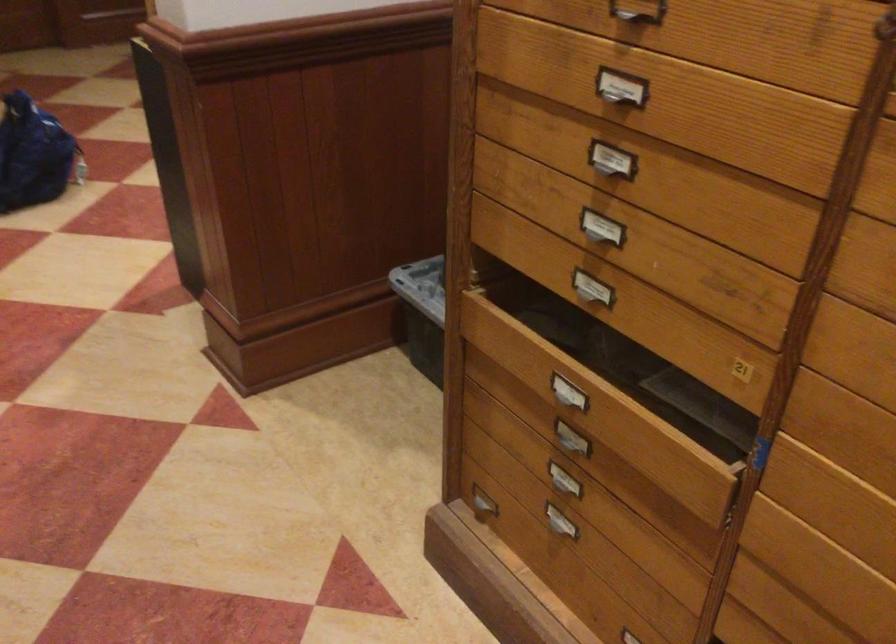
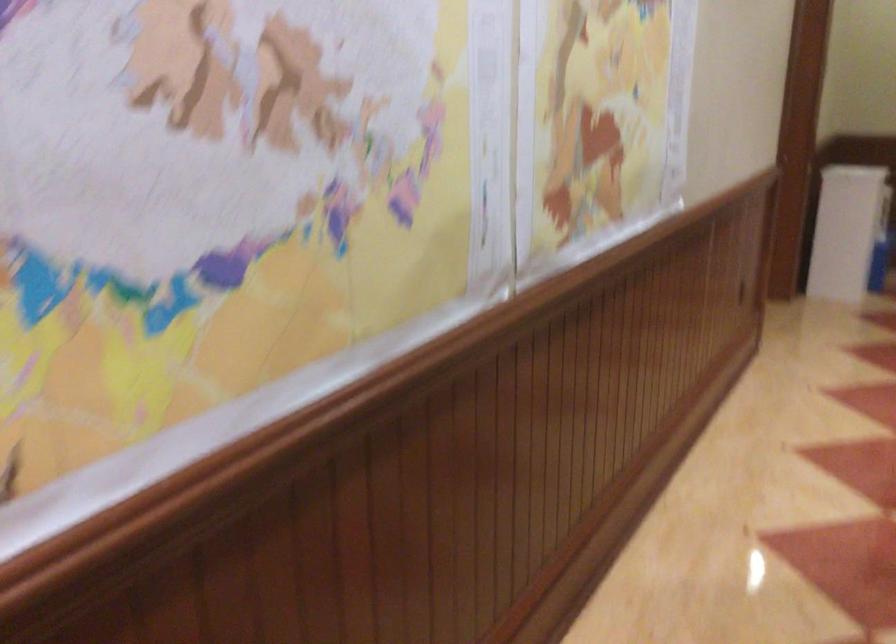
Question: The camera is either moving clockwise (left) or counter-clockwise (right) around the object. The first image is from the beginning of the video and the second image is from the end. Is the camera moving left or right when shooting the video?

Choices:
 (A) Left
 (B) Right

Answer: (B)